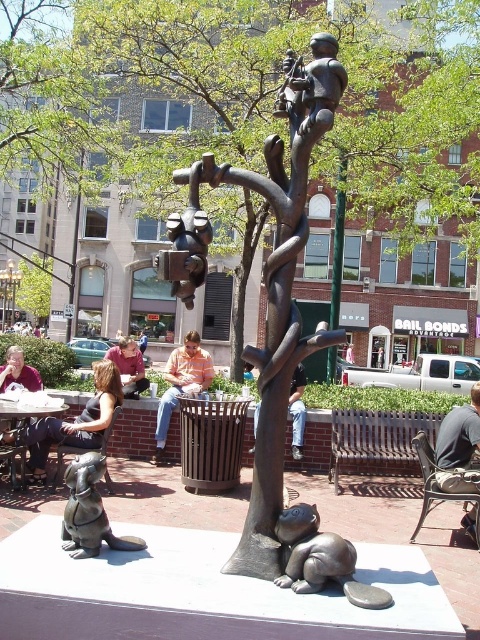
Question: Estimate the real-world distances between objects in this image. Which object is farther from the wooden bench at lower right?

Choices:
 (A) bronze tree at center
 (B) orange striped shirt at center
 (C) matte maroon shirt at lower left

Answer: (B)

Question: Considering the relative positions of matte black tank top at lower left and dark gray fabric jacket at lower right in the image provided, where is matte black tank top at lower left located with respect to dark gray fabric jacket at lower right?

Choices:
 (A) left
 (B) right

Answer: (A)

Question: Which of the following is the closest to the observer?

Choices:
 (A) matte black tank top at lower left
 (B) matte maroon shirt at lower left
 (C) brown bronze tree at center

Answer: (A)

Question: Which point appears closest to the camera in this image?

Choices:
 (A) (90, 477)
 (B) (451, 420)

Answer: (A)

Question: Can you confirm if matte black tank top at lower left is positioned to the right of brown bronze tree at center?

Choices:
 (A) yes
 (B) no

Answer: (A)

Question: Can you confirm if dark gray fabric jacket at lower right is positioned to the left of matte pink shirt at center?

Choices:
 (A) no
 (B) yes

Answer: (A)